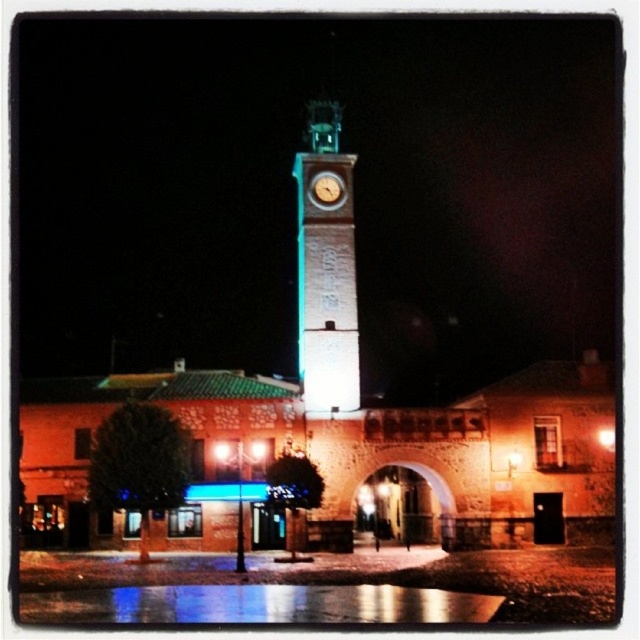
You are standing at the base of the clock tower in the nighttime scene. You notice a point marked at coordinates (346, 493) on the image. Which object does this point correspond to?

The point at coordinates (346, 493) corresponds to the brick wall archway at center.

You are a city planner reviewing the architectural plans for a new urban area. The design includes a white stone clock tower at center and a matte gold clock at center. Based on the provided scene, which object is taller?

The white stone clock tower at center is taller than the matte gold clock at center according to the description.